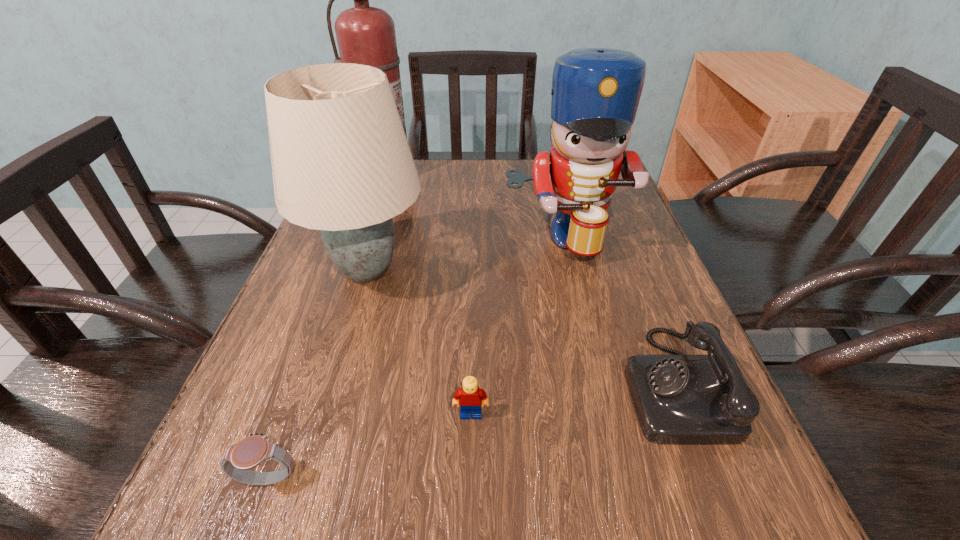
In order to click on fire extinguisher in this screenshot , I will do `click(366, 35)`.

The image size is (960, 540). What are the coordinates of `the farthest object` in the screenshot? It's located at (366, 35).

Locate an element on the screen. The image size is (960, 540). nutcracker is located at coordinates (595, 92).

Image resolution: width=960 pixels, height=540 pixels. Find the location of `lampshade`. lampshade is located at coordinates (341, 163).

Find the location of a particular element. The height and width of the screenshot is (540, 960). telephone is located at coordinates (679, 399).

Identify the location of the fourth object from left to right. (471, 397).

The height and width of the screenshot is (540, 960). What are the coordinates of `watch` in the screenshot? It's located at (253, 450).

Where is `free space located 0.190m on the front-facing side of the farthest object`? free space located 0.190m on the front-facing side of the farthest object is located at coordinates (371, 228).

At what (x,y) coordinates should I click in order to perform the action: click on vacant region located on the front-facing side of the nutcracker. Please return your answer as a coordinate pair (x, y). The height and width of the screenshot is (540, 960). Looking at the image, I should click on (619, 456).

The image size is (960, 540). In order to click on vacant space situated 0.120m on the front of the lampshade in this screenshot , I will do `click(338, 368)`.